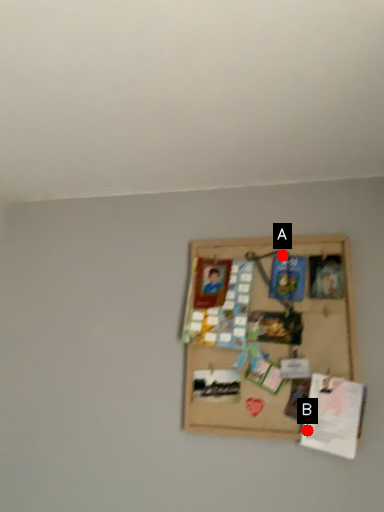
Question: Two points are circled on the image, labeled by A and B beside each circle. Among these points, which one is nearest to the camera?

Choices:
 (A) A is closer
 (B) B is closer

Answer: (B)